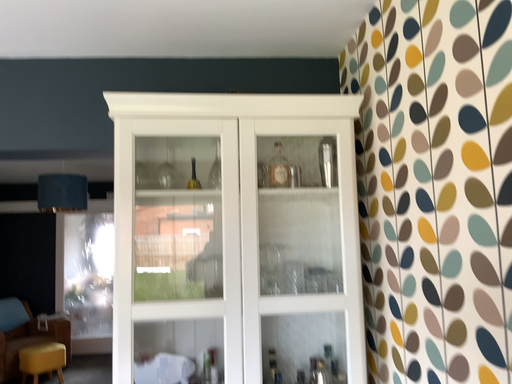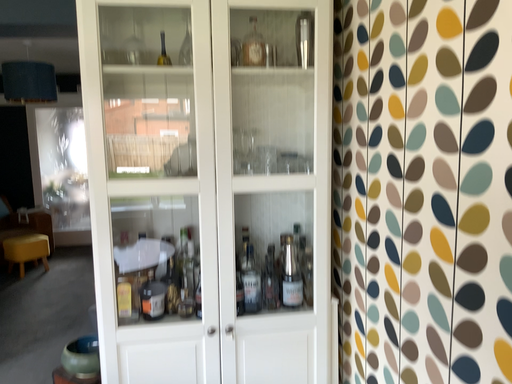
Question: Which way did the camera rotate in the video?

Choices:
 (A) rotated upward
 (B) rotated downward

Answer: (B)